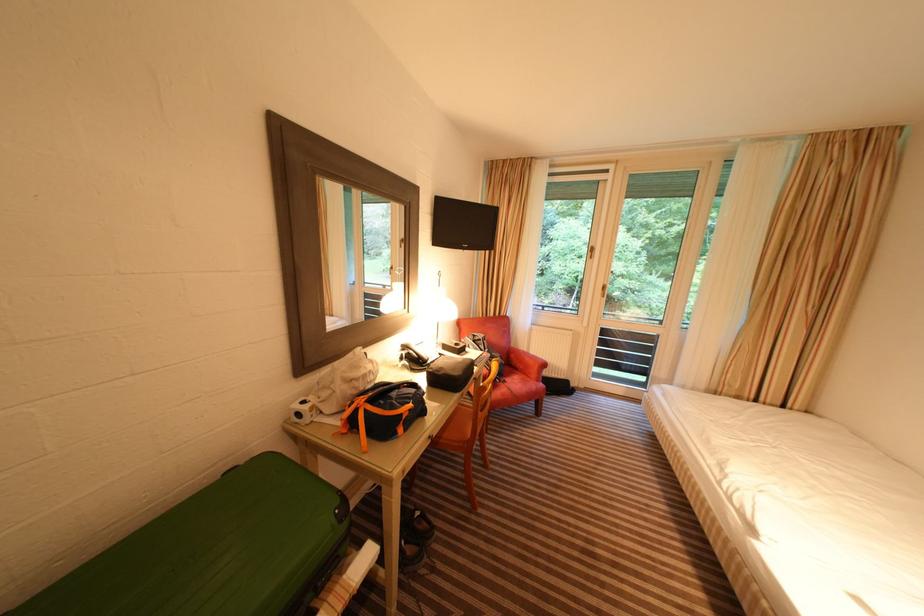
This screenshot has width=924, height=616. What do you see at coordinates (517, 386) in the screenshot?
I see `the red chair sitting surface` at bounding box center [517, 386].